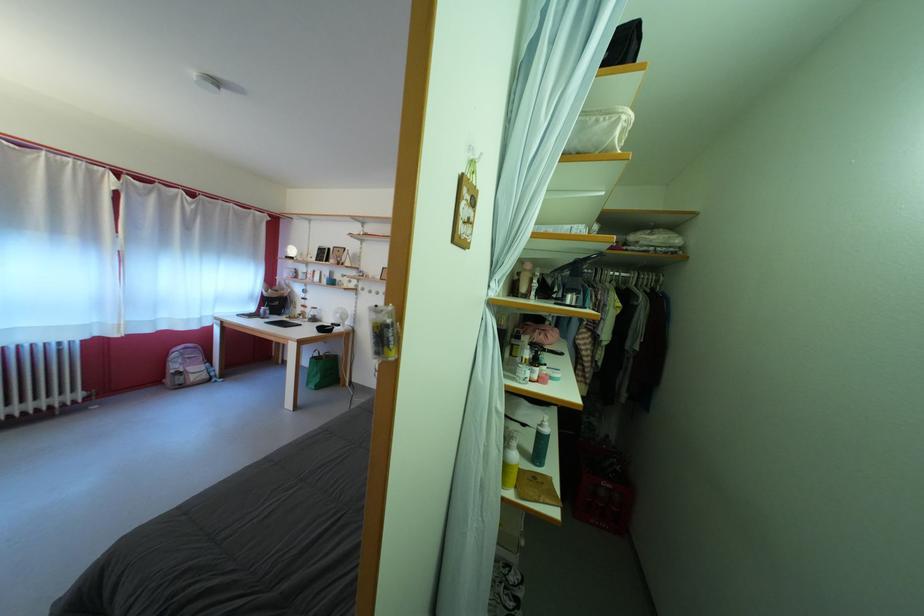
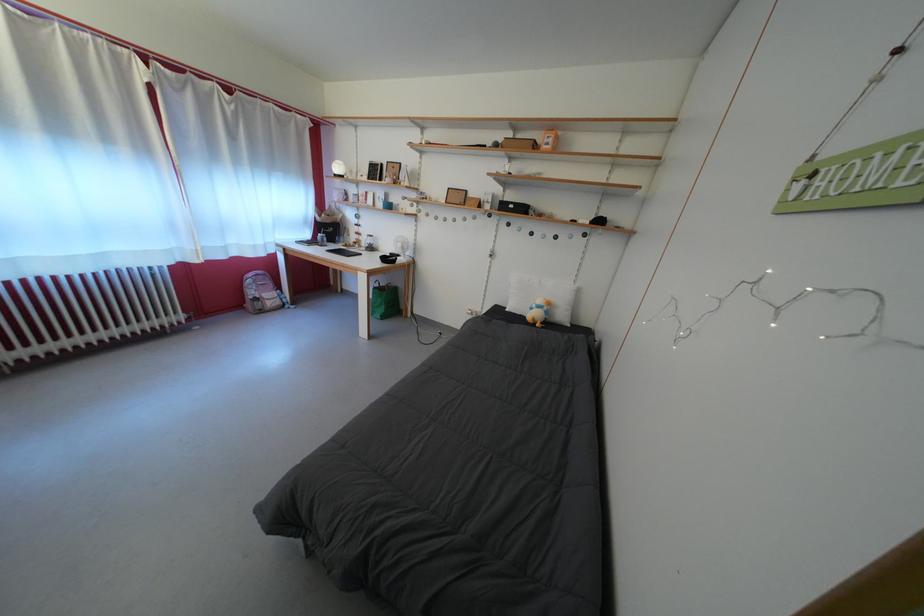
The point at [184,373] is marked in the first image. Where is the corresponding point in the second image?

(261, 299)